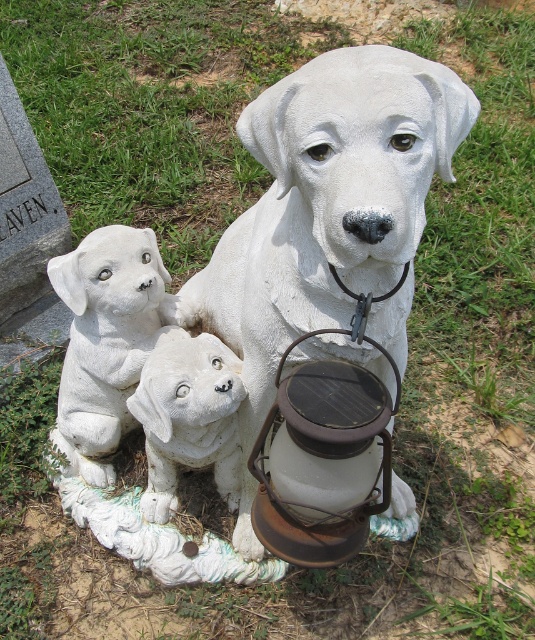
Question: Which is farther from the white stone puppies at lower left?

Choices:
 (A) rusty metal lantern at center
 (B) white stone dog at center
 (C) white matte dog at center

Answer: (A)

Question: Considering the relative positions of white stone dog at center and white stone puppies at lower left in the image provided, where is white stone dog at center located with respect to white stone puppies at lower left?

Choices:
 (A) above
 (B) below

Answer: (A)

Question: Does white stone puppies at lower left appear over white matte dog at center?

Choices:
 (A) yes
 (B) no

Answer: (A)

Question: Which of the following is the farthest from the observer?

Choices:
 (A) (80, 340)
 (B) (247, 285)

Answer: (A)

Question: Which of these objects is positioned farthest from the rusty metal lantern at center?

Choices:
 (A) white stone puppies at lower left
 (B) white matte dog at center

Answer: (A)

Question: Can you confirm if white stone dog at center is positioned above white matte dog at center?

Choices:
 (A) no
 (B) yes

Answer: (B)